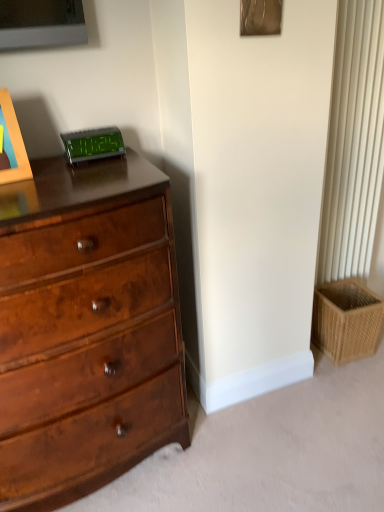
Question: Are shiny brown wood chest of drawers at left and green digital display at upper center far apart?

Choices:
 (A) yes
 (B) no

Answer: (B)

Question: Is shiny brown wood chest of drawers at left closer to camera compared to green digital display at upper center?

Choices:
 (A) yes
 (B) no

Answer: (A)

Question: Is shiny brown wood chest of drawers at left facing towards green digital display at upper center?

Choices:
 (A) yes
 (B) no

Answer: (B)

Question: Is shiny brown wood chest of drawers at left thinner than green digital display at upper center?

Choices:
 (A) yes
 (B) no

Answer: (B)

Question: From the image's perspective, does shiny brown wood chest of drawers at left appear higher than green digital display at upper center?

Choices:
 (A) yes
 (B) no

Answer: (B)

Question: Does shiny brown wood chest of drawers at left have a lesser height compared to green digital display at upper center?

Choices:
 (A) yes
 (B) no

Answer: (B)

Question: Considering the relative positions of green digital display at upper center and woven tan basket at lower right in the image provided, is green digital display at upper center to the right of woven tan basket at lower right from the viewer's perspective?

Choices:
 (A) yes
 (B) no

Answer: (B)

Question: Is green digital display at upper center behind woven tan basket at lower right?

Choices:
 (A) no
 (B) yes

Answer: (A)

Question: Does green digital display at upper center have a lesser width compared to woven tan basket at lower right?

Choices:
 (A) no
 (B) yes

Answer: (B)

Question: From a real-world perspective, is green digital display at upper center physically above woven tan basket at lower right?

Choices:
 (A) yes
 (B) no

Answer: (A)

Question: Is green digital display at upper center positioned beyond the bounds of woven tan basket at lower right?

Choices:
 (A) yes
 (B) no

Answer: (A)

Question: Considering the relative sizes of green digital display at upper center and woven tan basket at lower right in the image provided, is green digital display at upper center shorter than woven tan basket at lower right?

Choices:
 (A) no
 (B) yes

Answer: (B)

Question: Does shiny brown wood chest of drawers at left have a greater width compared to woven tan basket at lower right?

Choices:
 (A) no
 (B) yes

Answer: (B)